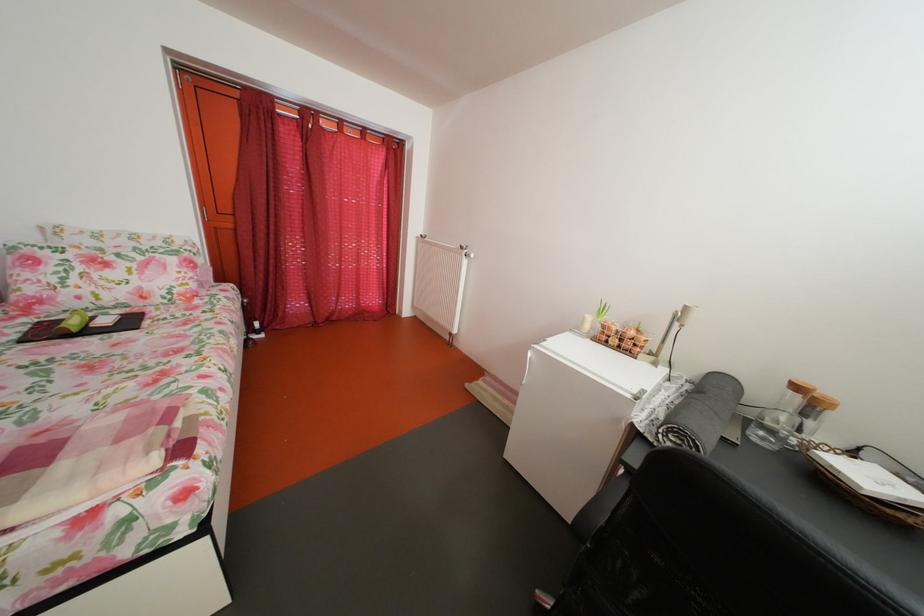
You are a GUI agent. You are given a task and a screenshot of the screen. Output one action in this format:
    pyautogui.click(x=<x>, y=<y>)
    Task: Click on the refrigerator door
    The height and width of the screenshot is (616, 924).
    Given the screenshot: What is the action you would take?
    pyautogui.click(x=563, y=431)